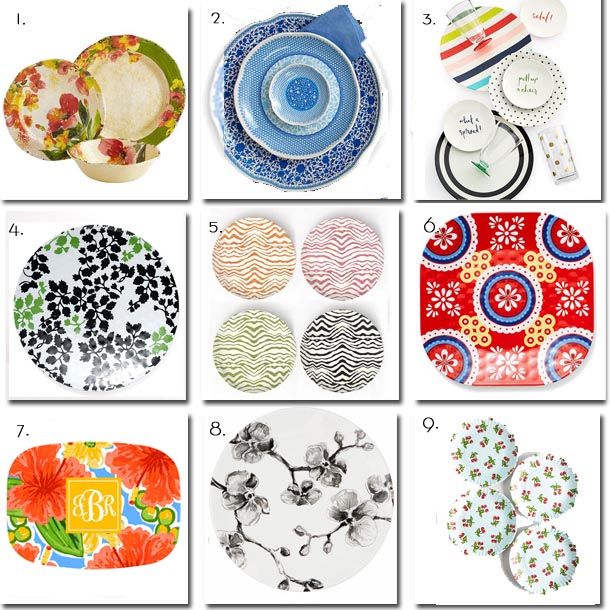
You are a GUI agent. You are given a task and a screenshot of the screen. Output one action in this format:
    pyautogui.click(x=<x>, y=<y>)
    Task: Click on the green plate with zigzags
    
    Given the screenshot: What is the action you would take?
    pyautogui.click(x=260, y=361)